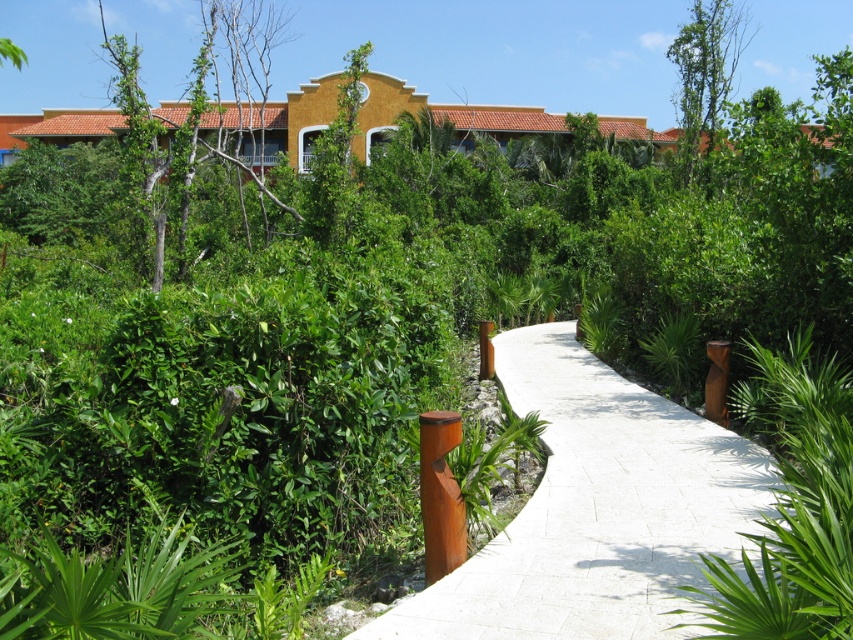
You are a landscape architect designing a garden and want to place a 30 inch wide statue between the green leafy tree at upper left and the bare wood tree at upper center. Based on the scene, will the statue fit in the space between them?

The distance between the green leafy tree at upper left and the bare wood tree at upper center is 26.83 inches. Since the statue is 30 inches wide, it will not fit in the space between them as the available space is narrower than the statue.

You are a maintenance worker tasked with trimming the green leafy tree at upper left. You have a ladder that can reach up to 20 meters. Can you safely trim the tree from the white concrete pavement at center without needing to move the ladder further away?

The distance between the white concrete pavement at center and the green leafy tree at upper left is 24.07 meters. Since the ladder can only reach up to 20 meters, you would need to move closer to the tree to safely trim it.

You are a gardener planning to plant a new tree in the garden. You see the white concrete pavement at center and the green leafy tree at upper left in the image. Which object takes up more space in the scene?

The green leafy tree at upper left takes up more space in the scene compared to the white concrete pavement at center, as the white concrete pavement at center has a smaller size.